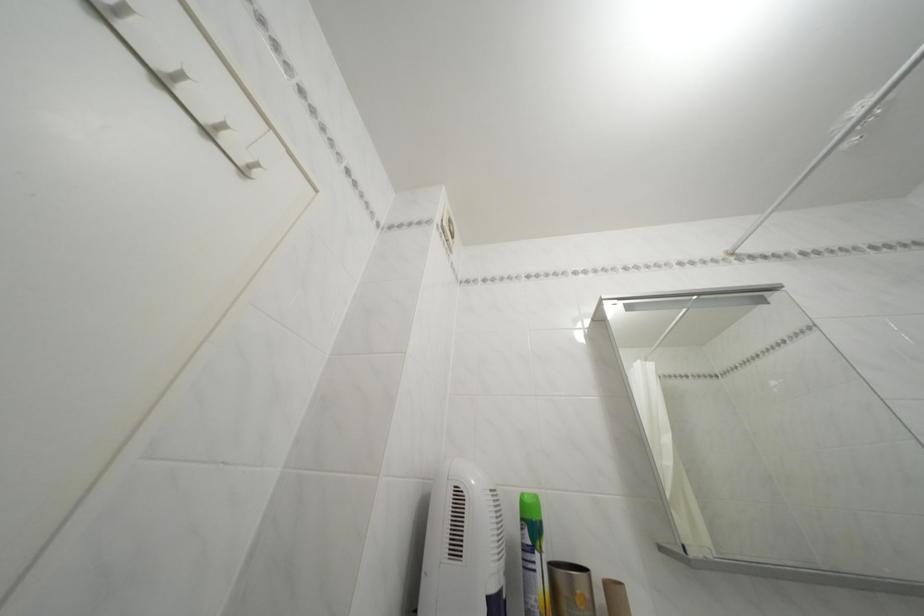
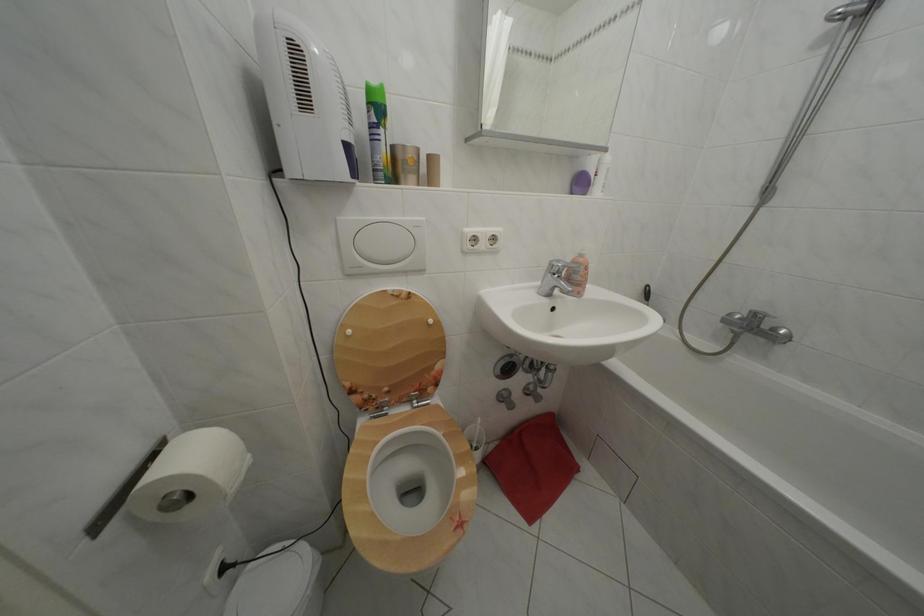
Where in the second image is the point corresponding to [531,525] from the first image?

(378, 110)